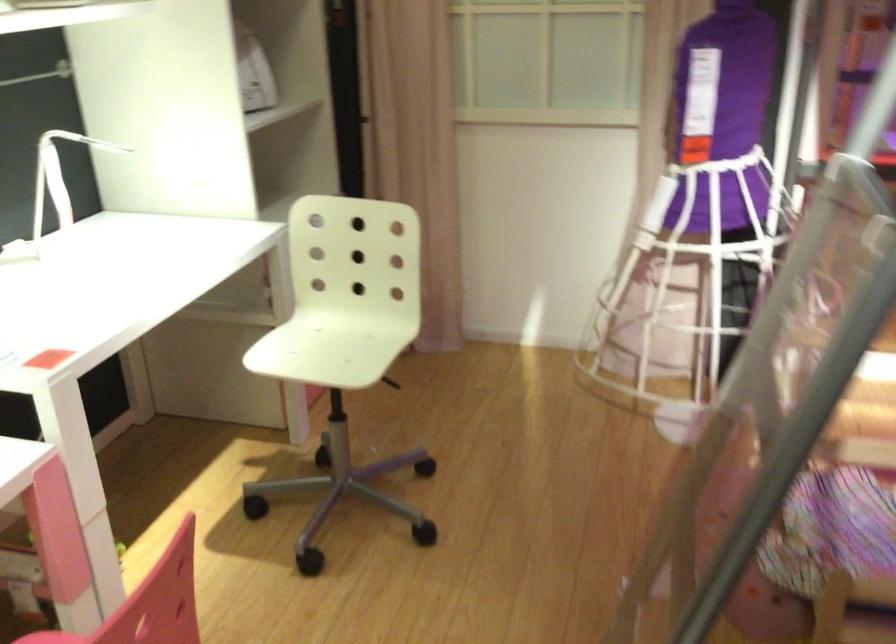
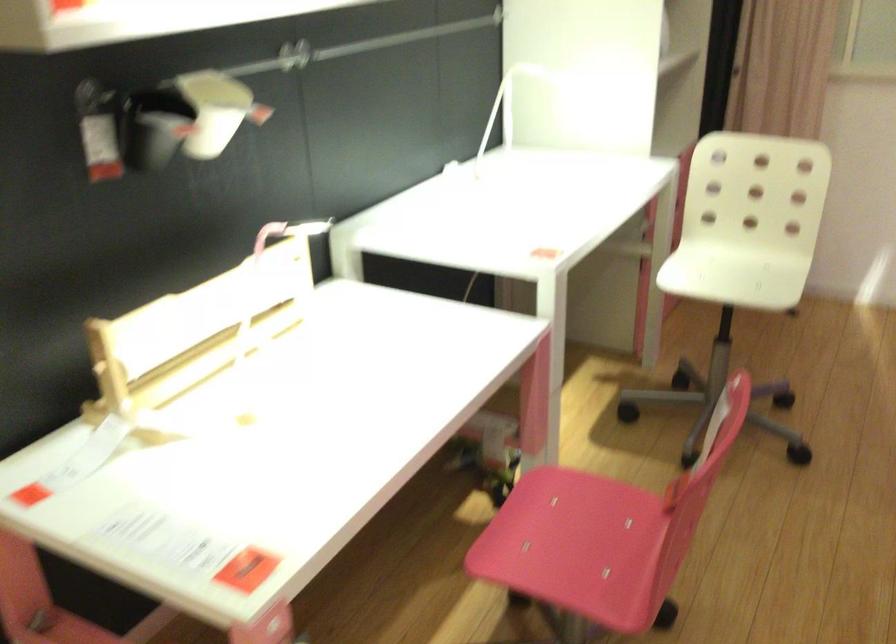
Question: How did the camera likely rotate?

Choices:
 (A) Left
 (B) Right
 (C) Up
 (D) Down

Answer: (A)